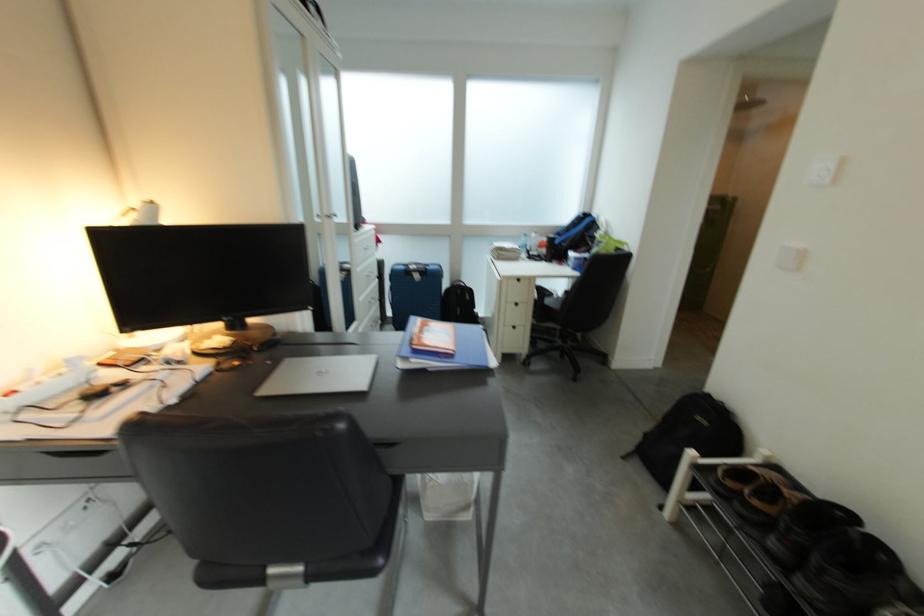
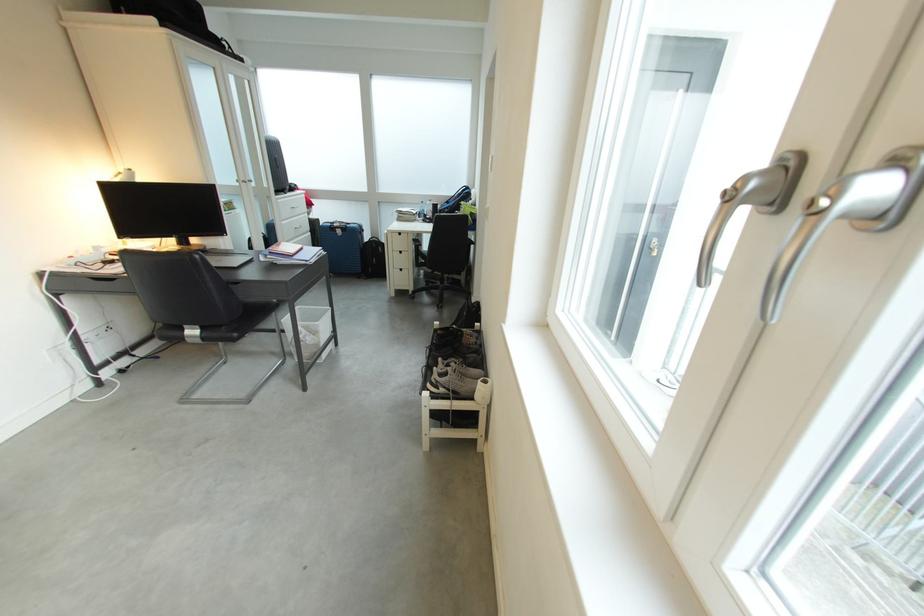
Locate, in the second image, the point that corresponds to point 480,301 in the first image.

(392, 254)